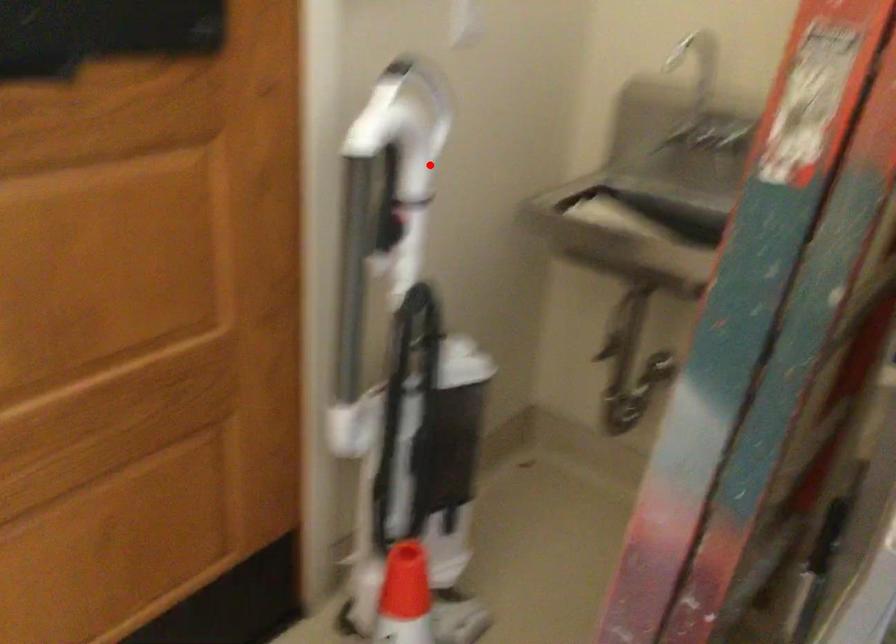
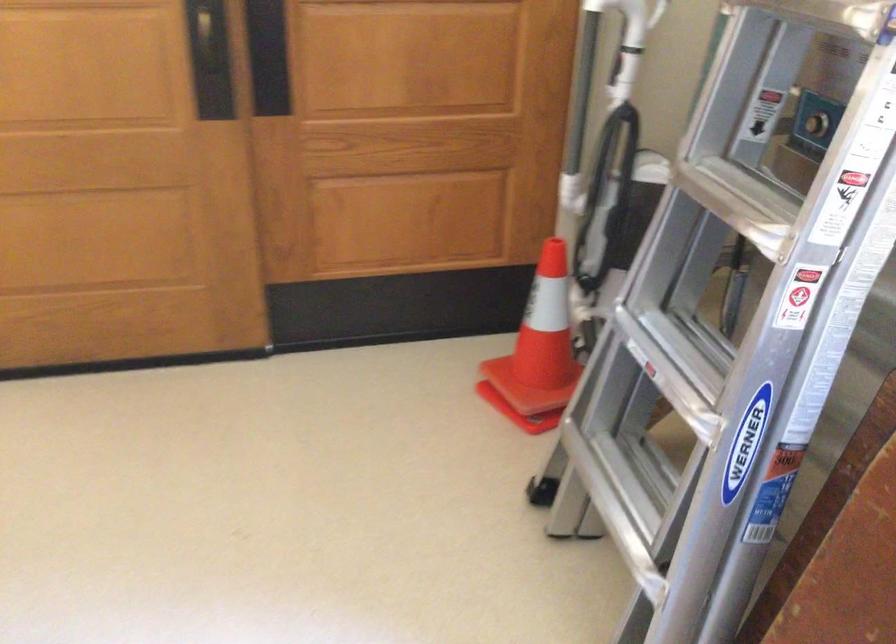
The point at the highlighted location is marked in the first image. Where is the corresponding point in the second image?

(630, 24)